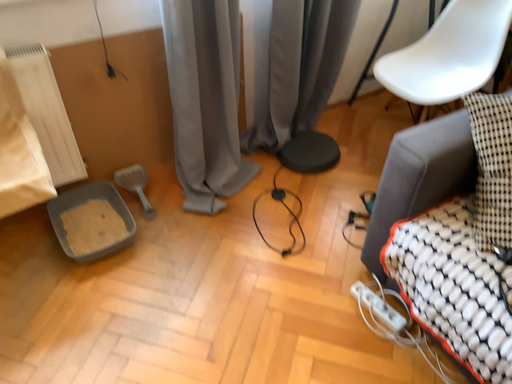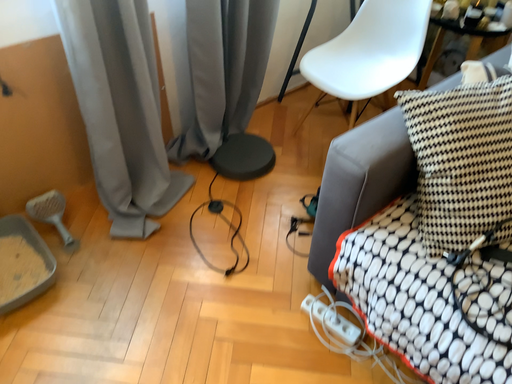
Question: How did the camera likely rotate when shooting the video?

Choices:
 (A) rotated left
 (B) rotated right

Answer: (B)